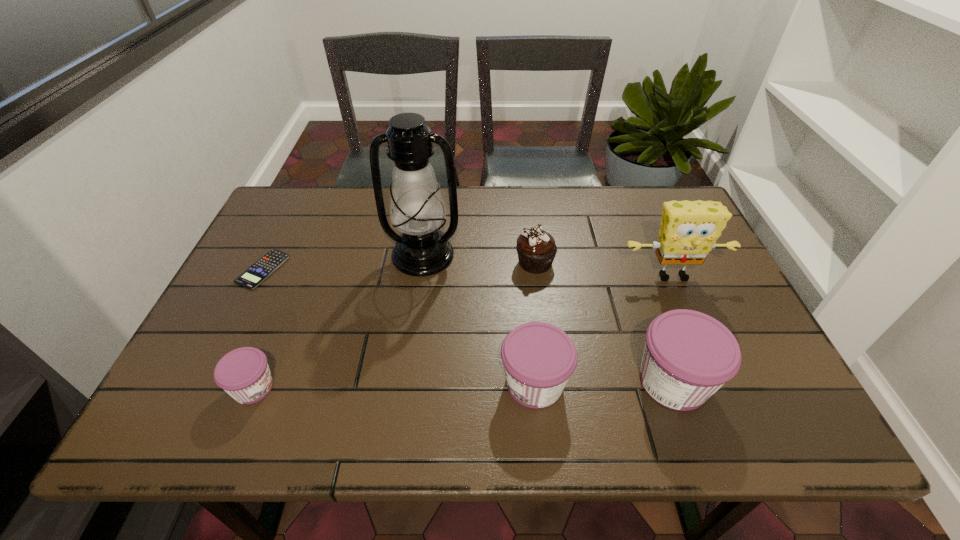
I want to click on jam that is the third closest one to the oil lamp, so click(688, 355).

Identify which jam is the closest to the sixth shortest object. Please provide its 2D coordinates. Your answer should be formatted as a tuple, i.e. [(x, y)], where the tuple contains the x and y coordinates of a point satisfying the conditions above.

[(688, 355)]

Where is `free space that satisfies the following two spatial constraints: 1. on the face of the sponge; 2. on the front label of the second tallest jam`? The height and width of the screenshot is (540, 960). free space that satisfies the following two spatial constraints: 1. on the face of the sponge; 2. on the front label of the second tallest jam is located at coordinates coord(719,383).

Locate an element on the screen. The width and height of the screenshot is (960, 540). blank area in the image that satisfies the following two spatial constraints: 1. on the face of the sponge; 2. on the front label of the rightmost jam is located at coordinates (718, 381).